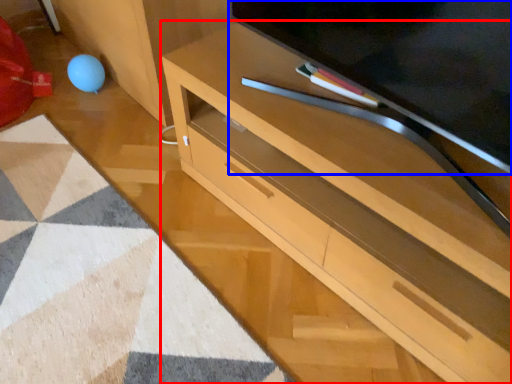
Question: Which object appears closest to the camera in this image, desk (highlighted by a red box) or television (highlighted by a blue box)?

Choices:
 (A) desk
 (B) television

Answer: (B)